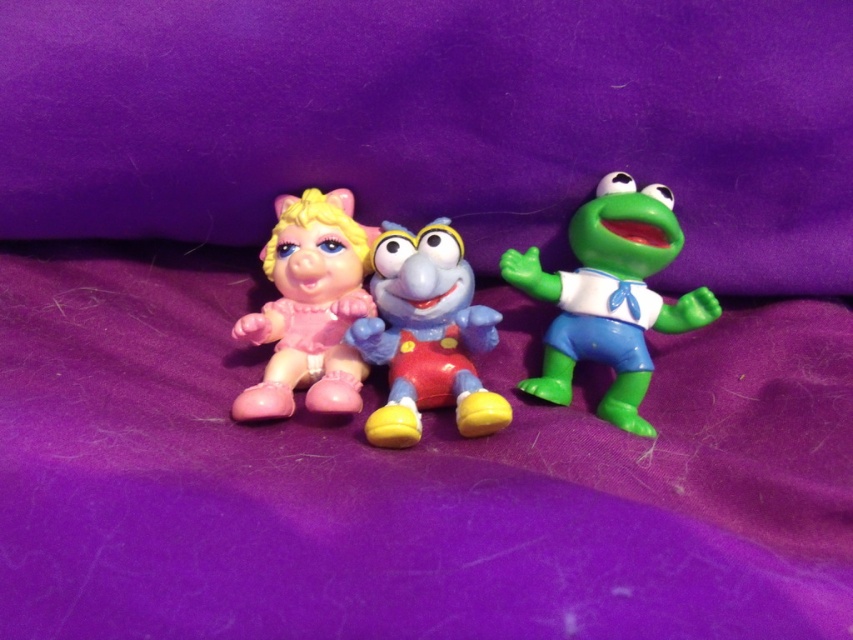
You are a child trying to find the plastic blue elephant at center in your toy box. You remember it was placed at point (426, 336). If the toy box has a coordinate system where the bottom left corner is 0,0 and the top right corner is 1,1, where should you look for the plastic blue elephant at center?

The plastic blue elephant at center is located at point (426, 336) in the coordinate system of the toy box, so you should look there.

You are a child looking at the three toy figurines on the purple fabric background. You want to place a sticker exactly at the point marked by coordinates point (610, 296). Which toy figurine will the sticker land on?

The sticker placed at point (610, 296) will land on the green plastic frog at right as the coordinates correspond to its position.

You are a photographer setting up for a photo shoot with the green plastic frog at right. The frog needs to be in focus while the other toys are slightly blurred. What should you adjust to achieve this effect?

To ensure the green plastic frog at right is in focus while the others are blurred, adjust the camera to a shallow depth of field. This will keep the frog sharp while blurring the foreground and background elements, including the other toys.